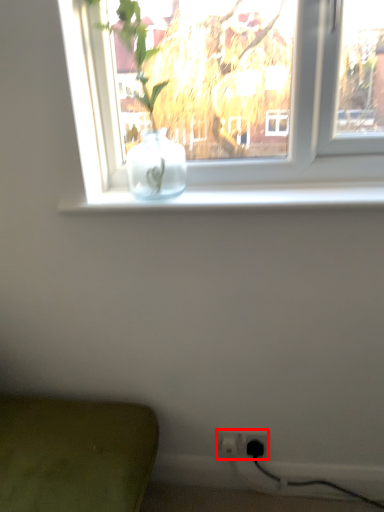
Question: From the image's perspective, what is the correct spatial positioning of electric outlet (annotated by the red box) in reference to electric outlet?

Choices:
 (A) above
 (B) below

Answer: (A)